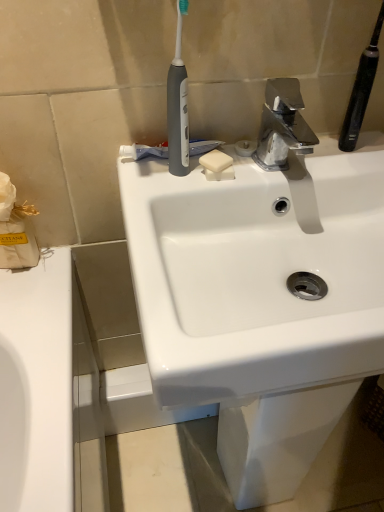
Question: Should I look upward or downward to see white matte soap at center?

Choices:
 (A) up
 (B) down

Answer: (A)

Question: Is white matte soap at center aimed at polished chrome faucet at upper center?

Choices:
 (A) yes
 (B) no

Answer: (B)

Question: Can you confirm if white matte soap at center is taller than polished chrome faucet at upper center?

Choices:
 (A) yes
 (B) no

Answer: (B)

Question: Is white matte soap at center closer to the viewer compared to polished chrome faucet at upper center?

Choices:
 (A) yes
 (B) no

Answer: (B)

Question: From a real-world perspective, is white matte soap at center located beneath polished chrome faucet at upper center?

Choices:
 (A) yes
 (B) no

Answer: (A)

Question: Is white matte soap at center completely or partially outside of polished chrome faucet at upper center?

Choices:
 (A) yes
 (B) no

Answer: (A)

Question: Does white matte soap at center lie behind polished chrome faucet at upper center?

Choices:
 (A) yes
 (B) no

Answer: (A)

Question: From the image's perspective, is white paper tissue at left beneath white matte soap at center?

Choices:
 (A) no
 (B) yes

Answer: (B)

Question: Is white paper tissue at left next to white matte soap at center?

Choices:
 (A) no
 (B) yes

Answer: (A)

Question: Does white paper tissue at left have a lesser height compared to white matte soap at center?

Choices:
 (A) yes
 (B) no

Answer: (B)

Question: Are white paper tissue at left and white matte soap at center located far from each other?

Choices:
 (A) yes
 (B) no

Answer: (B)

Question: Can you confirm if white paper tissue at left is bigger than white matte soap at center?

Choices:
 (A) no
 (B) yes

Answer: (B)

Question: From a real-world perspective, is white paper tissue at left positioned under white matte soap at center based on gravity?

Choices:
 (A) yes
 (B) no

Answer: (A)

Question: Does white paper tissue at left have a greater height compared to polished chrome faucet at upper center?

Choices:
 (A) yes
 (B) no

Answer: (A)